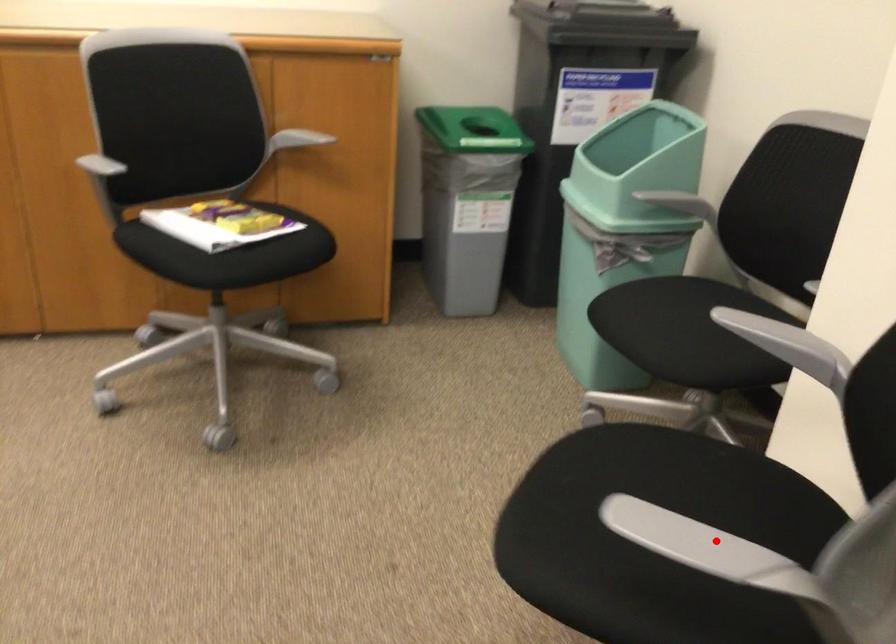
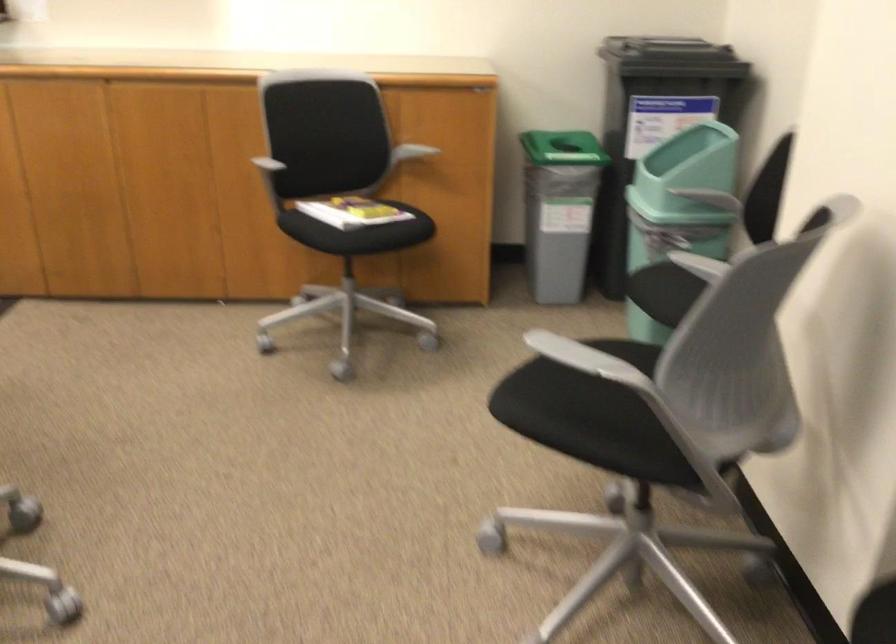
Question: I am providing you with two images of the same scene from different viewpoints. In image1, a red point is highlighted. Considering the same 3D point in image2, which of the following is correct?

Choices:
 (A) It is closer
 (B) It is farther

Answer: (B)